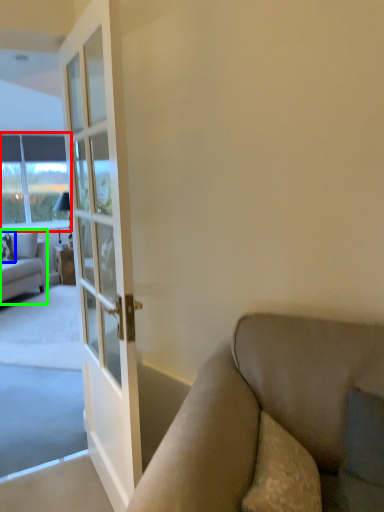
Question: Based on their relative distances, which object is farther from window (highlighted by a red box)? Choose from pillow (highlighted by a blue box) and studio couch (highlighted by a green box).

Choices:
 (A) pillow
 (B) studio couch

Answer: (A)